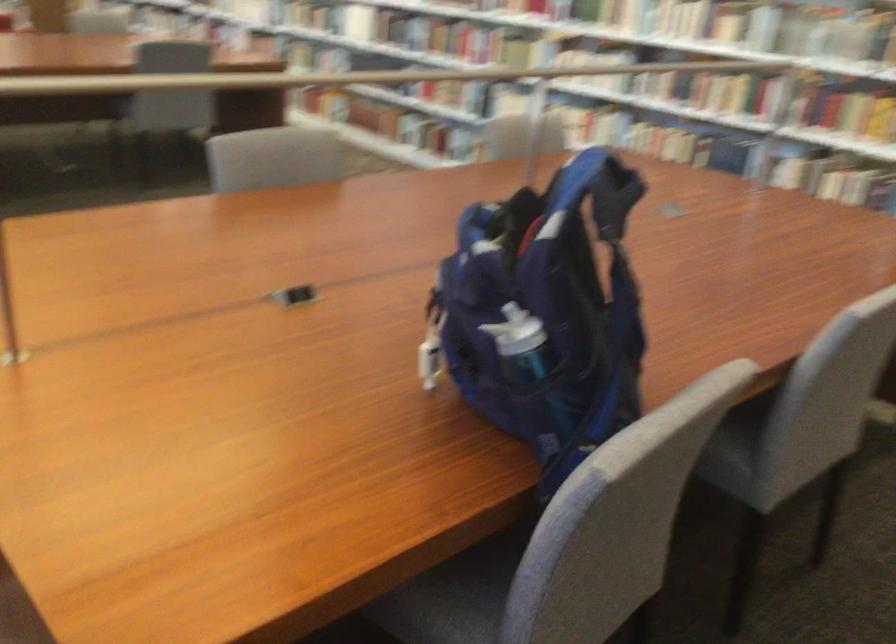
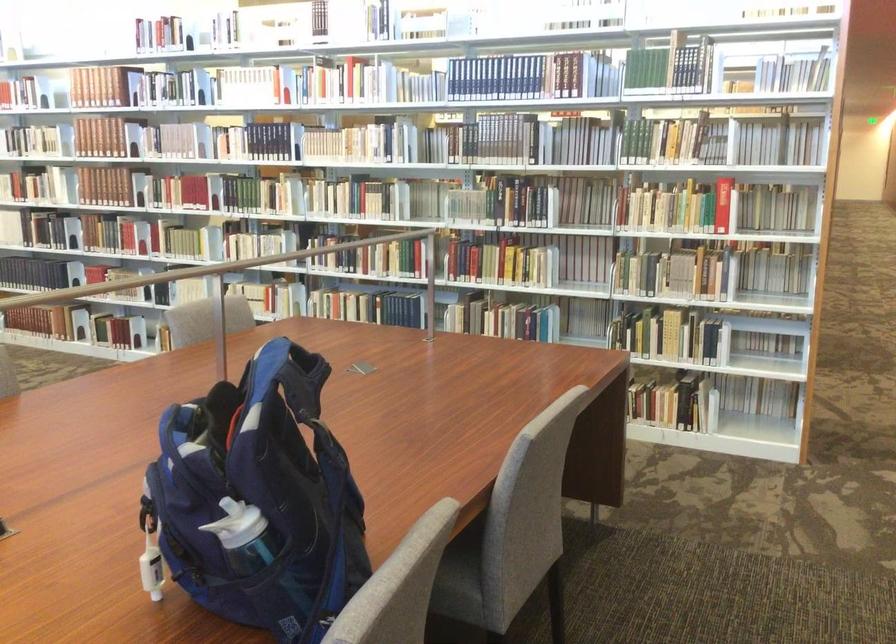
Question: How did the camera likely rotate?

Choices:
 (A) Left
 (B) Right
 (C) Up
 (D) Down

Answer: (B)